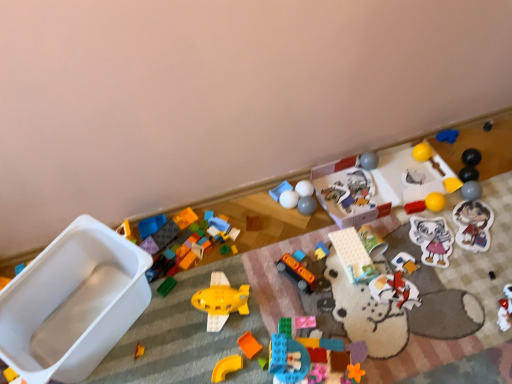
Identify the location of vacant space behind yellow plastic curve at center, the fifth toy in the left-to-right sequence. (226, 322).